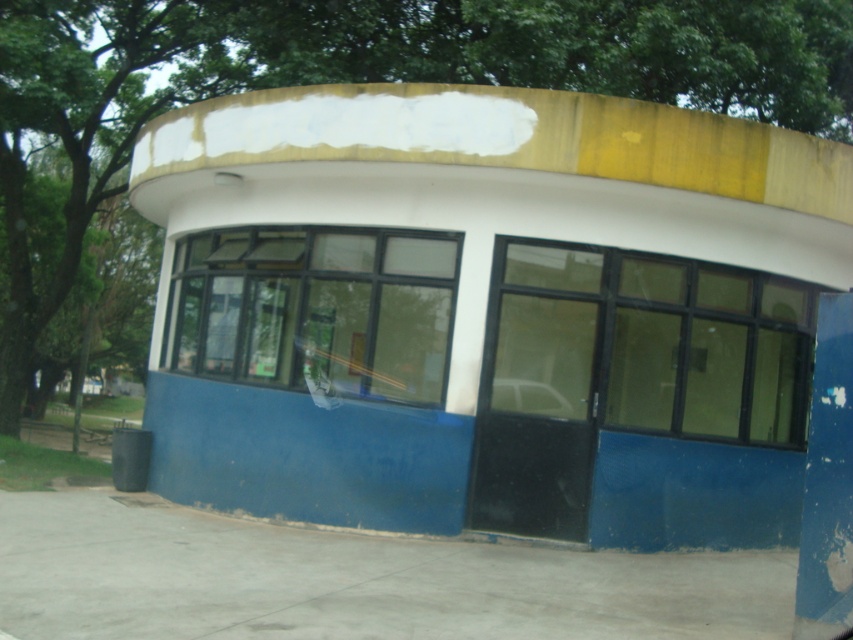
You are taking a photo of the building and want to focus on both point (605, 364) and point (532, 404). Which point should you adjust your camera focus to prioritize for better clarity?

Point (605, 364) is closer to the camera than point (532, 404), so you should prioritize focusing on point (605, 364) for better clarity.

You are standing in front of the building and want to locate the transparent glass window at center. Based on the coordinates provided, which object corresponds to the point marked at (659, 340)?

The point marked at (659, 340) corresponds to the transparent glass window at center.